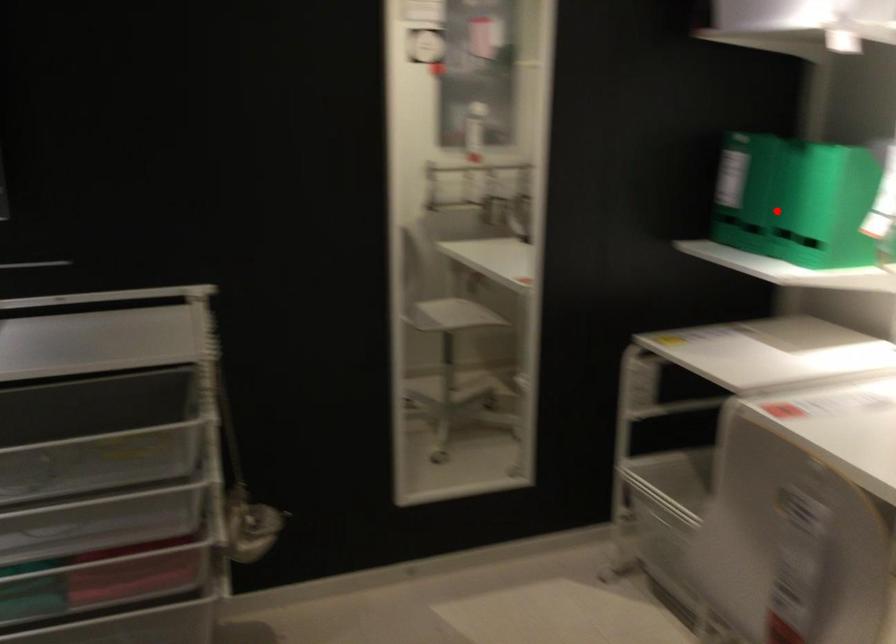
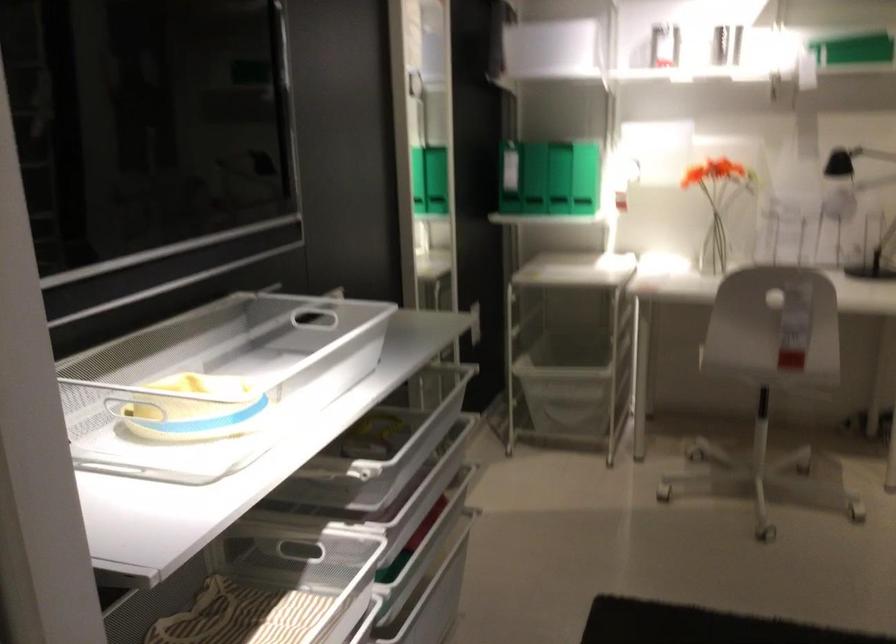
Question: I am providing you with two images of the same scene from different viewpoints. Image1 has a red point marked. In image2, the corresponding 3D location appears at what relative position? Reply with the corresponding letter.

Choices:
 (A) Closer
 (B) Farther

Answer: (B)